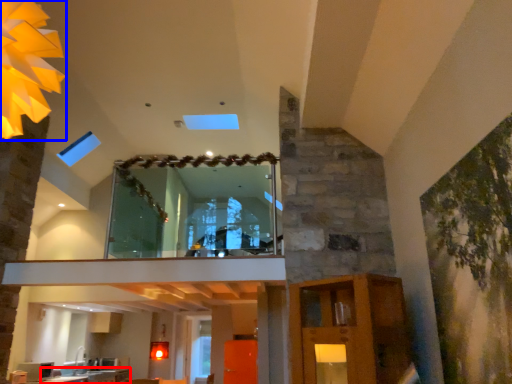
Question: Among these objects, which one is nearest to the camera, counter top (highlighted by a red box) or lighting (highlighted by a blue box)?

Choices:
 (A) counter top
 (B) lighting

Answer: (B)